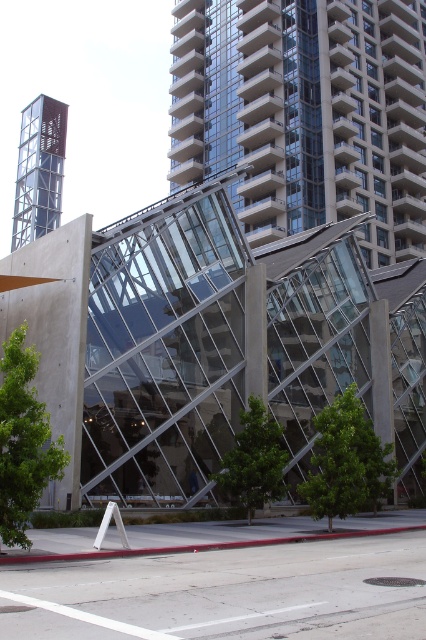
Based on the photo, you are a visitor approaching the entrance of the glassy concrete building at upper center and the clear glass elevator at upper left. Which structure is closer to the entrance?

The clear glass elevator at upper left is closer to the entrance because the glassy concrete building at upper center is positioned over it, meaning the elevator is in front of the building from the visitor perspective.

You are standing on the sidewalk in front of the modern architectural structure. You notice a point marked at coordinates (305, 113). Based on the description, where exactly is this point located?

The point is located on the glassy concrete building at upper center.